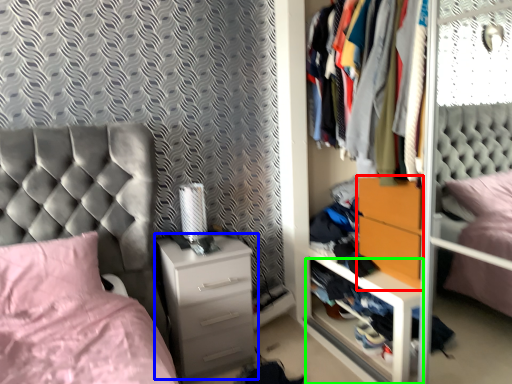
Question: Which object is positioned closest to nightstand (highlighted by a red box)? Select from chest of drawers (highlighted by a blue box) and shelf (highlighted by a green box).

Choices:
 (A) chest of drawers
 (B) shelf

Answer: (B)